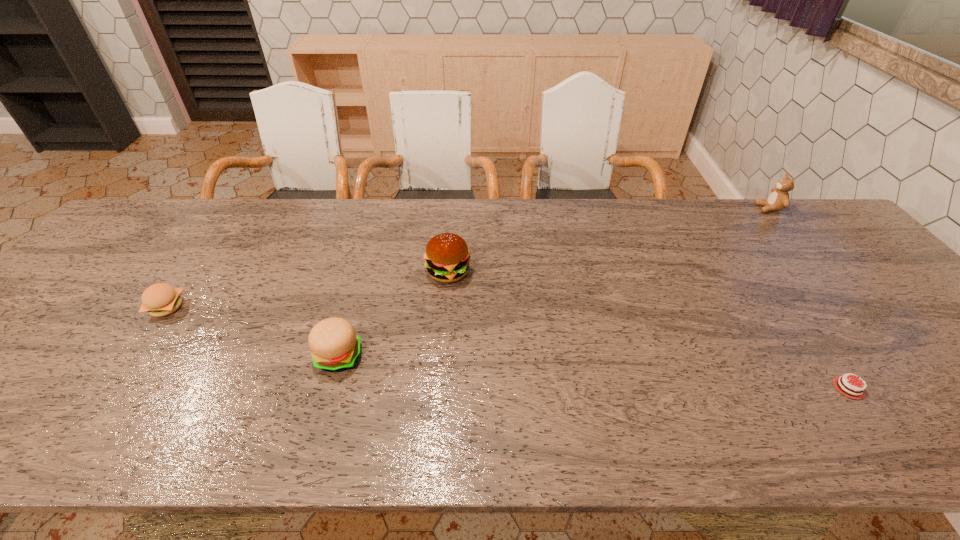
The height and width of the screenshot is (540, 960). What are the coordinates of `object that is at the far right corner` in the screenshot? It's located at (778, 200).

The image size is (960, 540). What are the coordinates of `vacant region at the far edge` in the screenshot? It's located at (482, 230).

In the image, there is a desktop. What are the coordinates of `free space at the near edge` in the screenshot? It's located at (780, 425).

I want to click on vacant space at the left edge of the desktop, so click(x=105, y=293).

I want to click on vacant region at the far right corner of the desktop, so click(x=808, y=214).

What are the coordinates of `free point between the fourth object from left to right and the second farthest hamburger` in the screenshot? It's located at (508, 348).

At what (x,y) coordinates should I click in order to perform the action: click on free space between the farthest object and the nearest hamburger. Please return your answer as a coordinate pair (x, y). Looking at the image, I should click on coord(554,282).

Image resolution: width=960 pixels, height=540 pixels. I want to click on free space between the leftmost hamburger and the second object from right to left, so click(508, 348).

Image resolution: width=960 pixels, height=540 pixels. Find the location of `vacant area that lies between the fourth nearest object and the second nearest hamburger`. vacant area that lies between the fourth nearest object and the second nearest hamburger is located at coordinates (307, 290).

Where is `free space between the farthest object and the chocolate cake`? free space between the farthest object and the chocolate cake is located at coordinates (808, 298).